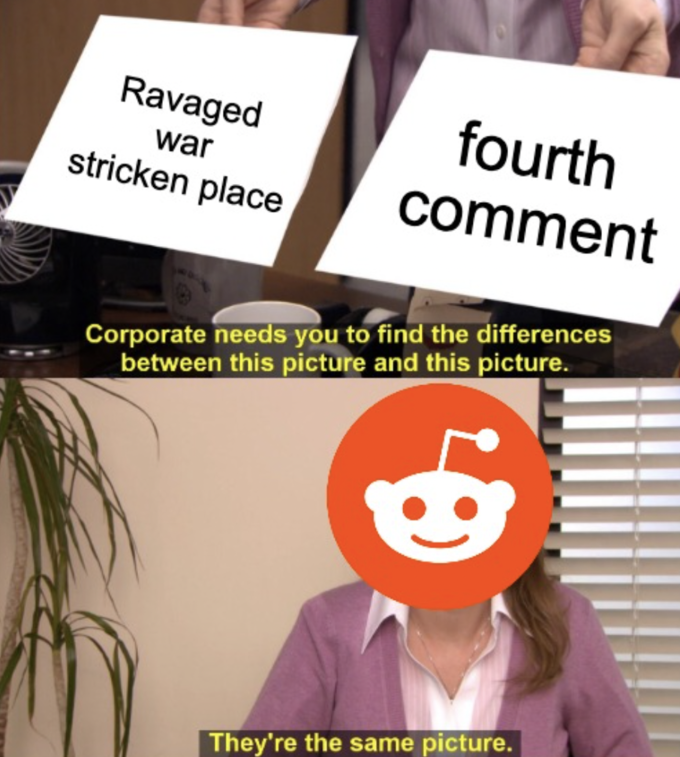
Locate an element on the screen. This screenshot has width=680, height=757. window blinds is located at coordinates (627, 509).